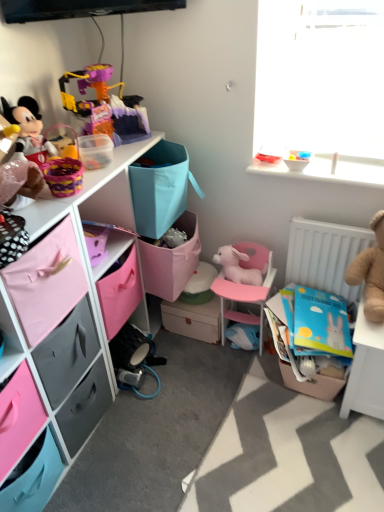
This screenshot has width=384, height=512. What are the coordinates of `vacant space positioned to the left of pink plastic chair at center` in the screenshot? It's located at (190, 359).